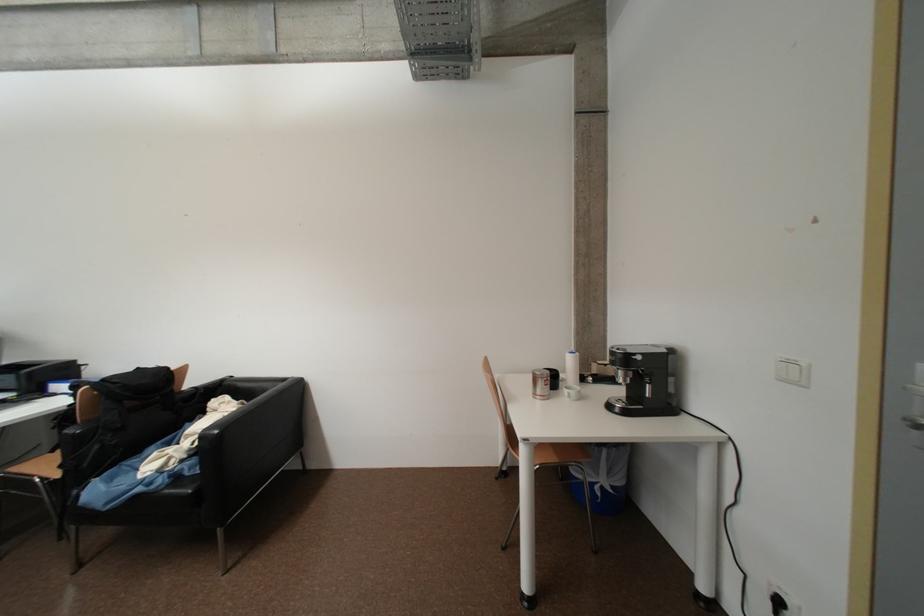
The width and height of the screenshot is (924, 616). Describe the element at coordinates (247, 424) in the screenshot. I see `the black sofa armrest` at that location.